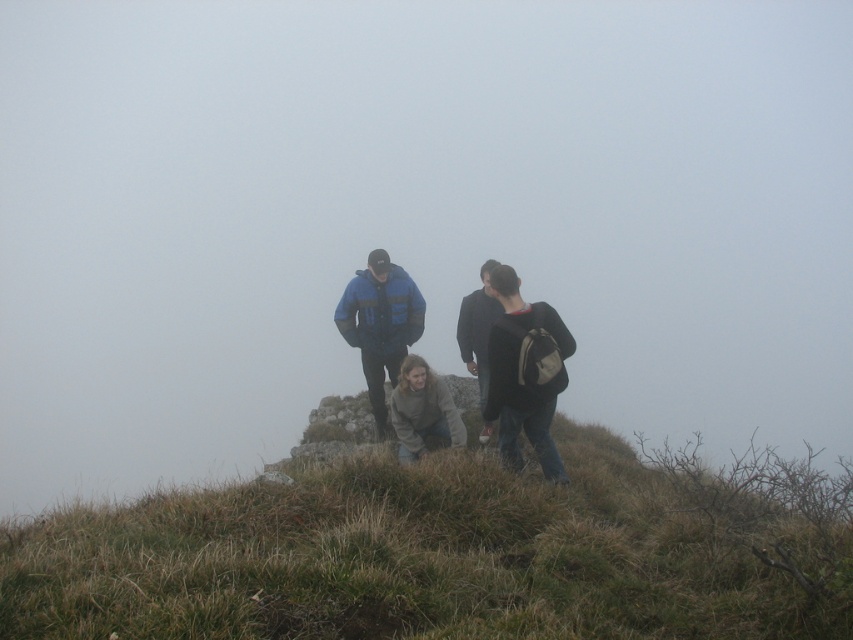
Describe the element at coordinates (519, 376) in the screenshot. I see `dark gray backpack at center` at that location.

Between dark gray backpack at center and dark gray sweater at center, which one appears on the right side from the viewer's perspective?

dark gray backpack at center is more to the right.

The height and width of the screenshot is (640, 853). Identify the location of dark gray backpack at center. (519, 376).

Which is more to the right, green grassy hillside at center or dark gray sweater at center?

dark gray sweater at center is more to the right.

Does green grassy hillside at center have a larger size compared to dark gray sweater at center?

Yes.

Is point (355, 516) farther from viewer compared to point (477, 333)?

No, (355, 516) is in front of (477, 333).

I want to click on green grassy hillside at center, so click(x=440, y=554).

Which is more to the right, light brown sweater at center or dark gray sweater at center?

dark gray sweater at center is more to the right.

Between light brown sweater at center and dark gray sweater at center, which one is positioned lower?

light brown sweater at center is below.

Which is in front, point (410, 380) or point (482, 314)?

Point (410, 380) is in front.

This screenshot has width=853, height=640. I want to click on light brown sweater at center, so click(x=422, y=410).